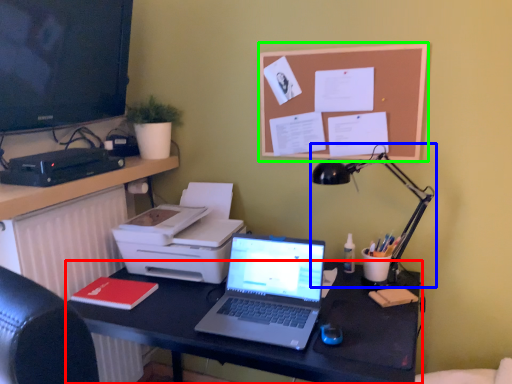
Question: Which object is positioned farthest from desk (highlighted by a red box)? Select from lamp (highlighted by a blue box) and bulletin board (highlighted by a green box).

Choices:
 (A) lamp
 (B) bulletin board

Answer: (B)